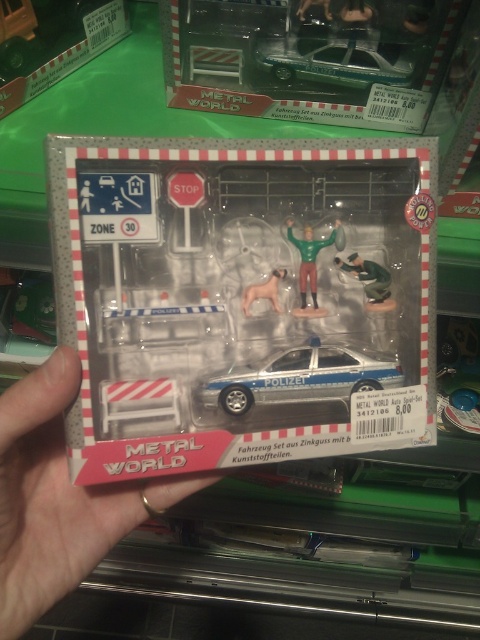
What do you see at coordinates (310, 259) in the screenshot?
I see `green matte figure at center` at bounding box center [310, 259].

Who is taller, green matte figure at center or matte green figure at center?

Standing taller between the two is green matte figure at center.

Does point (314, 308) come in front of point (372, 262)?

Yes, point (314, 308) is closer to viewer.

I want to click on green matte figure at center, so click(x=310, y=259).

Which is behind, point (396, 65) or point (312, 275)?

Point (396, 65)

Identify the location of metallic silver police car at upper center. (326, 61).

Identify the location of metallic silver police car at upper center. (326, 61).

Can you confirm if metal matte hand at center is positioned above green matte figure at center?

No.

Who is taller, metal matte hand at center or green matte figure at center?

Standing taller between the two is metal matte hand at center.

At what (x,y) coordinates should I click in order to perform the action: click on metal matte hand at center. Please return your answer as a coordinate pair (x, y). Looking at the image, I should click on (59, 499).